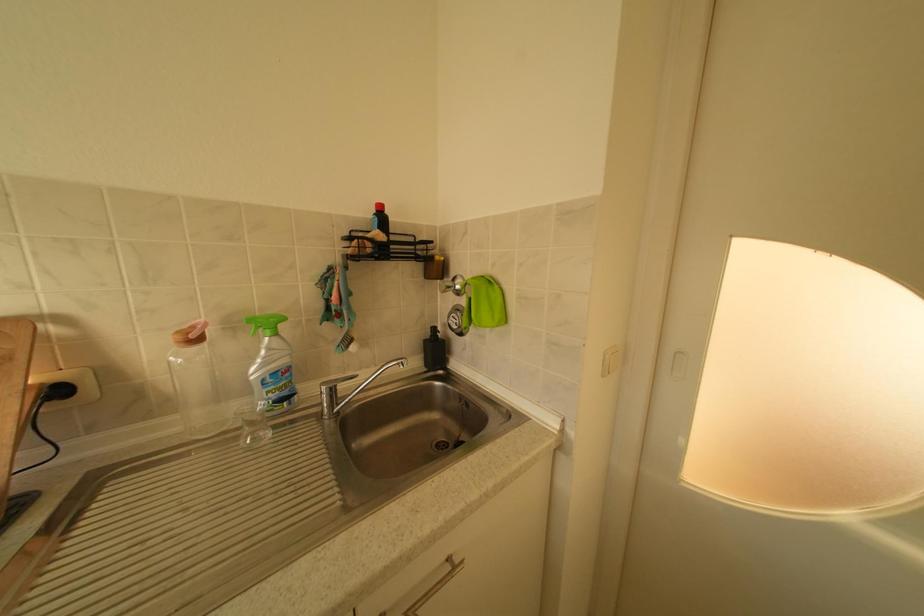
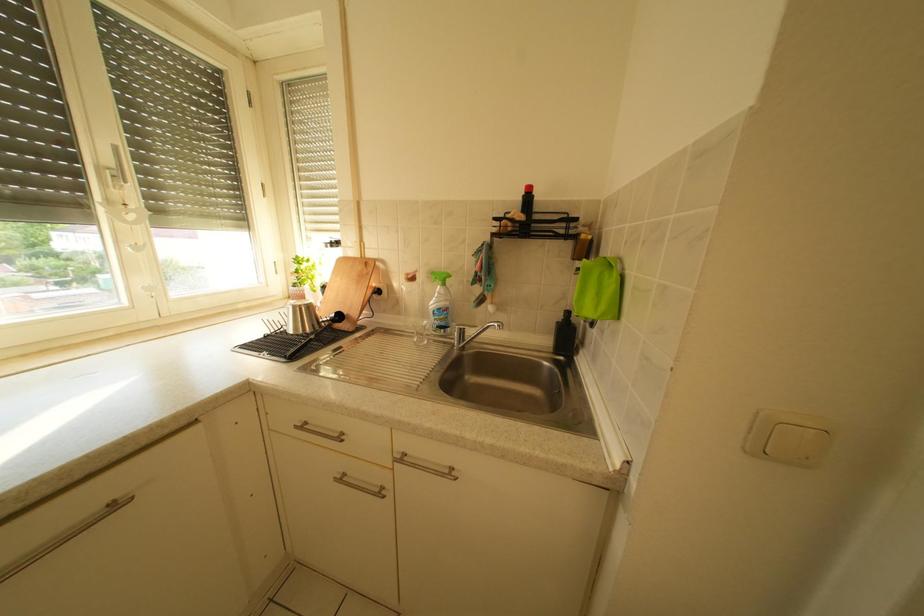
Question: Based on the continuous images, in which direction is the camera rotating? Reply with the corresponding letter.

Choices:
 (A) Left
 (B) Right
 (C) Up
 (D) Down

Answer: (A)